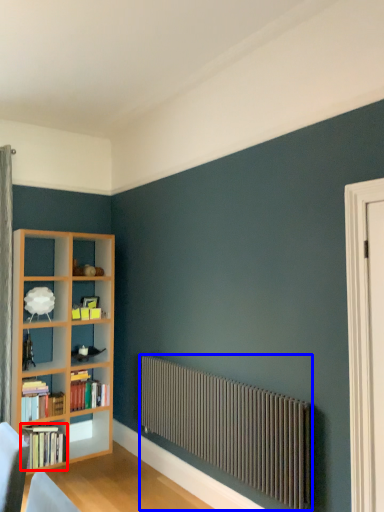
Question: Which object appears closest to the camera in this image, book (highlighted by a red box) or radiator (highlighted by a blue box)?

Choices:
 (A) book
 (B) radiator

Answer: (B)